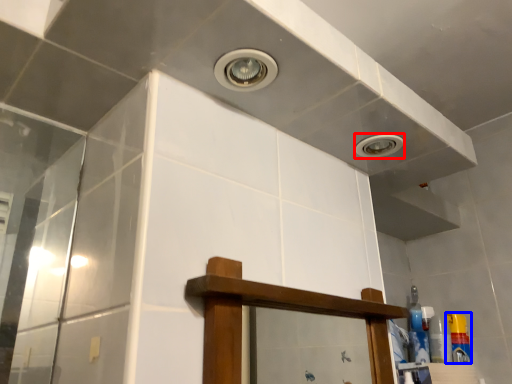
Question: Which object is closer to the camera taking this photo, droplight (highlighted by a red box) or toiletry (highlighted by a blue box)?

Choices:
 (A) droplight
 (B) toiletry

Answer: (A)